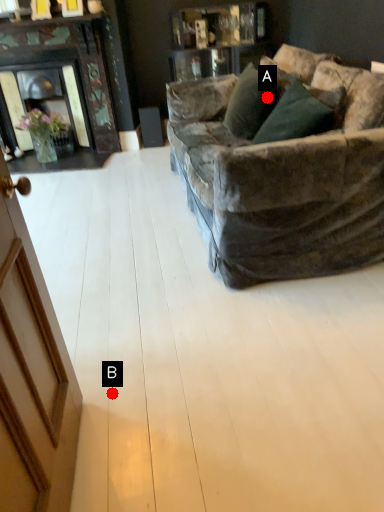
Question: Two points are circled on the image, labeled by A and B beside each circle. Which point is closer to the camera?

Choices:
 (A) A is closer
 (B) B is closer

Answer: (B)